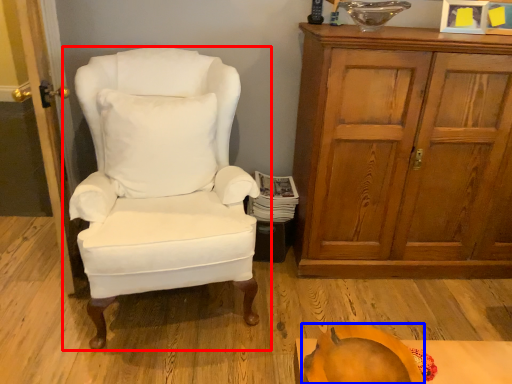
Question: Which point is closer to the camera, chair (highlighted by a red box) or pumpkin (highlighted by a blue box)?

Choices:
 (A) chair
 (B) pumpkin

Answer: (B)